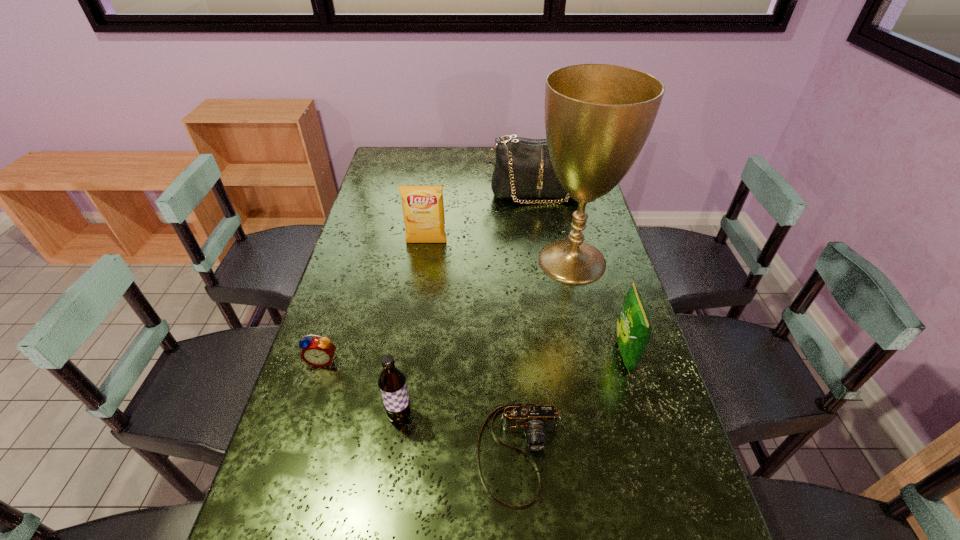
Where is `trophy cup`? The height and width of the screenshot is (540, 960). trophy cup is located at coordinates (598, 117).

Locate an element on the screen. The image size is (960, 540). handbag is located at coordinates (523, 169).

The image size is (960, 540). I want to click on the farther crisp (potato chip), so click(423, 209).

Find the location of a particular element. The width and height of the screenshot is (960, 540). root beer is located at coordinates (392, 381).

Where is `the nearer crisp (potato chip)`? This screenshot has width=960, height=540. the nearer crisp (potato chip) is located at coordinates (633, 328).

Where is `the right crisp (potato chip)`? The image size is (960, 540). the right crisp (potato chip) is located at coordinates (633, 328).

The image size is (960, 540). In order to click on the sixth tallest object in this screenshot , I will do `click(319, 352)`.

Find the location of a particular element. the leftmost object is located at coordinates (319, 352).

Find the location of `the shortest object`. the shortest object is located at coordinates (534, 420).

In order to click on free point located on the left of the trophy cup in this screenshot , I will do `click(471, 261)`.